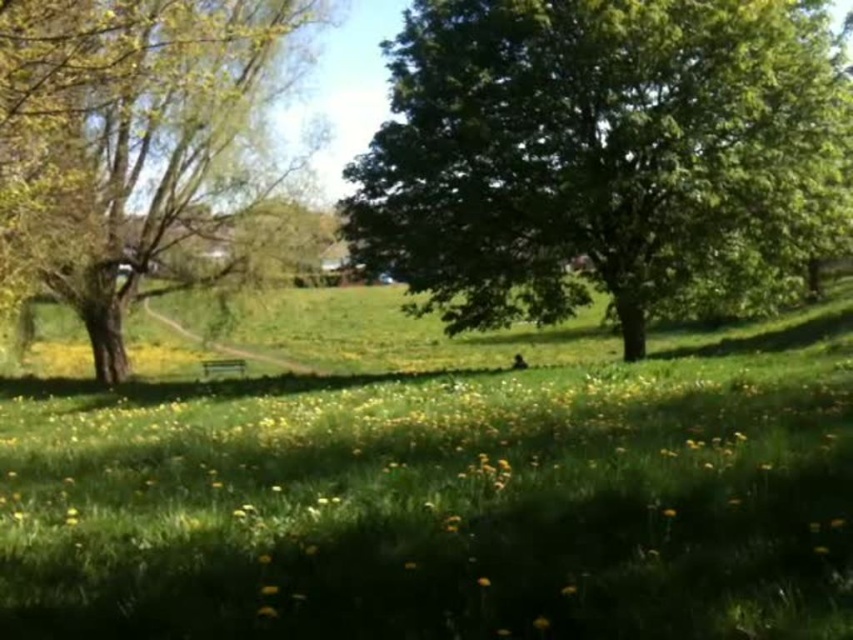
Question: Can you confirm if green grass at center is wider than green leafy tree at left?

Choices:
 (A) no
 (B) yes

Answer: (B)

Question: In this image, where is green grass at center located relative to green leafy tree at left?

Choices:
 (A) below
 (B) above

Answer: (A)

Question: Estimate the real-world distances between objects in this image. Which object is farther from the green leafy tree at left?

Choices:
 (A) green leafy tree at center
 (B) green grass at center

Answer: (A)

Question: Which point is farther from the camera taking this photo?

Choices:
 (A) coord(387,228)
 (B) coord(196,140)
 (C) coord(236,516)

Answer: (B)

Question: Observing the image, what is the correct spatial positioning of green grass at center in reference to green leafy tree at center?

Choices:
 (A) left
 (B) right

Answer: (A)

Question: Which object is closer to the camera taking this photo?

Choices:
 (A) green leafy tree at left
 (B) green leafy tree at center

Answer: (A)